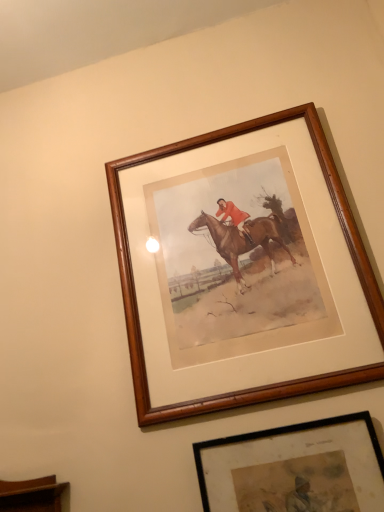
Question: In the image, is wooden frame at upper center, marked as the first picture frame in a top-to-bottom arrangement, positioned in front of or behind wooden framed print at center, the first picture frame ordered from the bottom?

Choices:
 (A) front
 (B) behind

Answer: (B)

Question: Is point (278, 119) closer or farther from the camera than point (306, 476)?

Choices:
 (A) farther
 (B) closer

Answer: (A)

Question: Based on their sizes in the image, would you say wooden frame at upper center, which appears as the 2th picture frame when ordered from the bottom, is bigger or smaller than wooden framed print at center, placed as the second picture frame when sorted from top to bottom?

Choices:
 (A) big
 (B) small

Answer: (A)

Question: Does point (362, 457) appear closer or farther from the camera than point (142, 407)?

Choices:
 (A) closer
 (B) farther

Answer: (A)

Question: From the image's perspective, relative to wooden frame at upper center, which appears as the 2th picture frame when ordered from the bottom, is wooden framed print at center, the first picture frame ordered from the bottom, above or below?

Choices:
 (A) below
 (B) above

Answer: (A)

Question: Looking at their shapes, would you say wooden framed print at center, placed as the second picture frame when sorted from top to bottom, is wider or thinner than wooden frame at upper center, marked as the first picture frame in a top-to-bottom arrangement?

Choices:
 (A) thin
 (B) wide

Answer: (A)

Question: From a real-world perspective, is wooden framed print at center, the first picture frame ordered from the bottom, physically located above or below wooden frame at upper center, marked as the first picture frame in a top-to-bottom arrangement?

Choices:
 (A) above
 (B) below

Answer: (B)